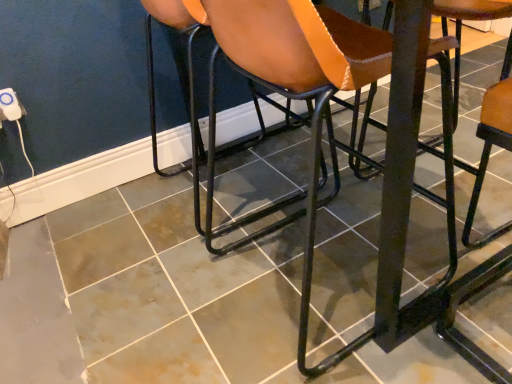
Question: From the image's perspective, is brown leather chair at center, the 3th chair viewed from the right, beneath brown leather chair at center, positioned as the second chair in left-to-right order?

Choices:
 (A) yes
 (B) no

Answer: (B)

Question: Is brown leather chair at center, the 3th chair viewed from the right, turned away from brown leather chair at center, arranged as the second chair when viewed from the right?

Choices:
 (A) no
 (B) yes

Answer: (A)

Question: Considering the relative positions of brown leather chair at center, the 3th chair viewed from the right, and brown leather chair at center, positioned as the second chair in left-to-right order, in the image provided, is brown leather chair at center, the 3th chair viewed from the right, in front of brown leather chair at center, positioned as the second chair in left-to-right order,?

Choices:
 (A) yes
 (B) no

Answer: (B)

Question: Is brown leather chair at center, the 1th chair from the left, bigger than brown leather chair at center, positioned as the second chair in left-to-right order?

Choices:
 (A) no
 (B) yes

Answer: (A)

Question: Is brown leather chair at center, positioned as the second chair in left-to-right order, completely or partially inside brown leather chair at center, the 3th chair viewed from the right?

Choices:
 (A) yes
 (B) no

Answer: (B)

Question: Is metallic black stool at right, which ranks as the 1th chair in right-to-left order, wider or thinner than brown leather chair at center, arranged as the second chair when viewed from the right?

Choices:
 (A) wide
 (B) thin

Answer: (B)

Question: Is metallic black stool at right, which is the third chair in left-to-right order, in front of or behind brown leather chair at center, arranged as the second chair when viewed from the right, in the image?

Choices:
 (A) behind
 (B) front

Answer: (A)

Question: From a real-world perspective, relative to brown leather chair at center, positioned as the second chair in left-to-right order, is metallic black stool at right, which ranks as the 1th chair in right-to-left order, vertically above or below?

Choices:
 (A) below
 (B) above

Answer: (A)

Question: From the image's perspective, relative to brown leather chair at center, arranged as the second chair when viewed from the right, is metallic black stool at right, which is the third chair in left-to-right order, above or below?

Choices:
 (A) below
 (B) above

Answer: (A)

Question: From the image's perspective, is brown leather chair at center, positioned as the second chair in left-to-right order, located above or below metallic black stool at right, which ranks as the 1th chair in right-to-left order?

Choices:
 (A) above
 (B) below

Answer: (A)

Question: From a real-world perspective, is brown leather chair at center, arranged as the second chair when viewed from the right, positioned above or below metallic black stool at right, which is the third chair in left-to-right order?

Choices:
 (A) above
 (B) below

Answer: (A)

Question: Does point (246, 34) appear closer or farther from the camera than point (463, 238)?

Choices:
 (A) closer
 (B) farther

Answer: (A)

Question: Is brown leather chair at center, arranged as the second chair when viewed from the right, wider or thinner than metallic black stool at right, which ranks as the 1th chair in right-to-left order?

Choices:
 (A) thin
 (B) wide

Answer: (B)

Question: Is brown leather chair at center, arranged as the second chair when viewed from the right, wider or thinner than brown leather chair at center, the 1th chair from the left?

Choices:
 (A) wide
 (B) thin

Answer: (B)

Question: Based on their positions, is brown leather chair at center, arranged as the second chair when viewed from the right, located to the left or right of brown leather chair at center, the 3th chair viewed from the right?

Choices:
 (A) right
 (B) left

Answer: (A)